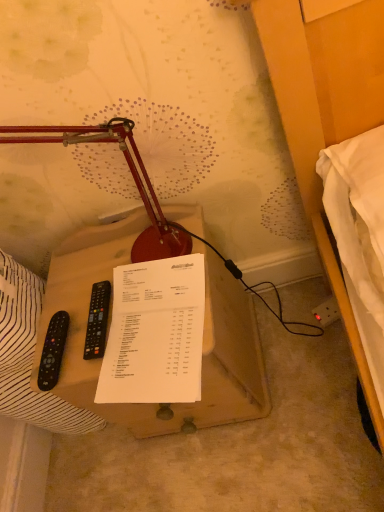
Locate an element on the screen. The height and width of the screenshot is (512, 384). free space in front of wooden table at center is located at coordinates (262, 460).